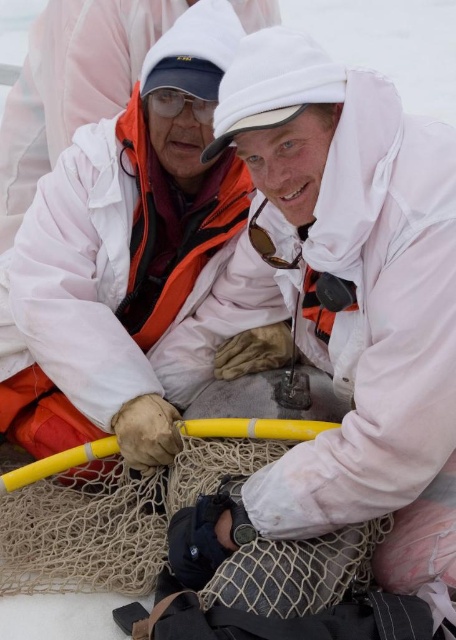
Can you confirm if matte white jacket at upper center is positioned to the right of sunglasses at center?

Incorrect, matte white jacket at upper center is not on the right side of sunglasses at center.

From the picture: How distant is matte white jacket at upper center from sunglasses at center?

4.70 meters

Is point (57, 92) positioned after point (257, 209)?

Yes.

Locate an element on the screen. The image size is (456, 640). matte white jacket at upper center is located at coordinates (71, 86).

Where is `matte black goggles at upper center`? Image resolution: width=456 pixels, height=640 pixels. matte black goggles at upper center is located at coordinates (179, 104).

Who is more forward, (145, 97) or (253, 234)?

Point (253, 234)

Where is `matte black goggles at upper center`? The image size is (456, 640). matte black goggles at upper center is located at coordinates (179, 104).

Can you confirm if white matte jacket at center is taller than matte white jacket at upper center?

Correct, white matte jacket at center is much taller as matte white jacket at upper center.

Between white matte jacket at center and matte white jacket at upper center, which one is positioned higher?

matte white jacket at upper center is above.

What are the coordinates of `white matte jacket at center` in the screenshot? It's located at (348, 301).